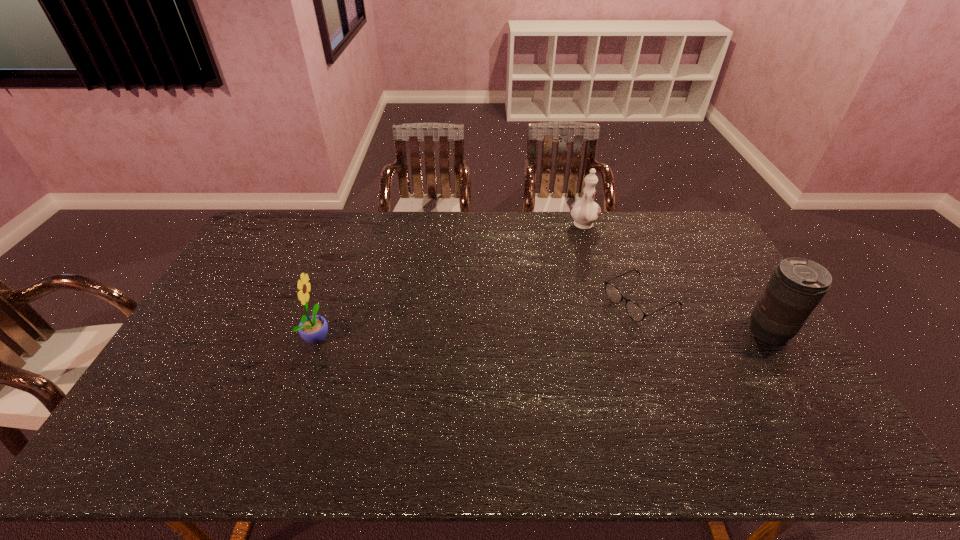
What are the coordinates of `free region located 0.120m on the front-facing side of the shortest object` in the screenshot? It's located at (584, 329).

Find the location of a particular element. The height and width of the screenshot is (540, 960). free space located at the spout of the chinaware is located at coordinates (562, 282).

Find the location of `blank space located 0.160m at the spout of the chinaware`. blank space located 0.160m at the spout of the chinaware is located at coordinates (570, 261).

Find the location of a particular element. The width and height of the screenshot is (960, 540). free location located 0.300m at the spout of the chinaware is located at coordinates (560, 286).

This screenshot has height=540, width=960. In order to click on object present at the far edge in this screenshot , I will do `click(585, 212)`.

You are a GUI agent. You are given a task and a screenshot of the screen. Output one action in this format:
    pyautogui.click(x=<x>, y=<y>)
    Task: Click on the object that is at the right edge
    The width and height of the screenshot is (960, 540).
    Given the screenshot: What is the action you would take?
    pyautogui.click(x=797, y=285)

Find the location of a particular element. Image resolution: width=960 pixels, height=540 pixels. free spot at the far edge of the desktop is located at coordinates (478, 211).

Find the location of a particular element. This screenshot has width=960, height=540. free space at the near edge is located at coordinates (239, 412).

Identify the location of free space at the left edge of the desktop. (213, 323).

Find the location of a particular element. The width and height of the screenshot is (960, 540). vacant space at the right edge of the desktop is located at coordinates [706, 300].